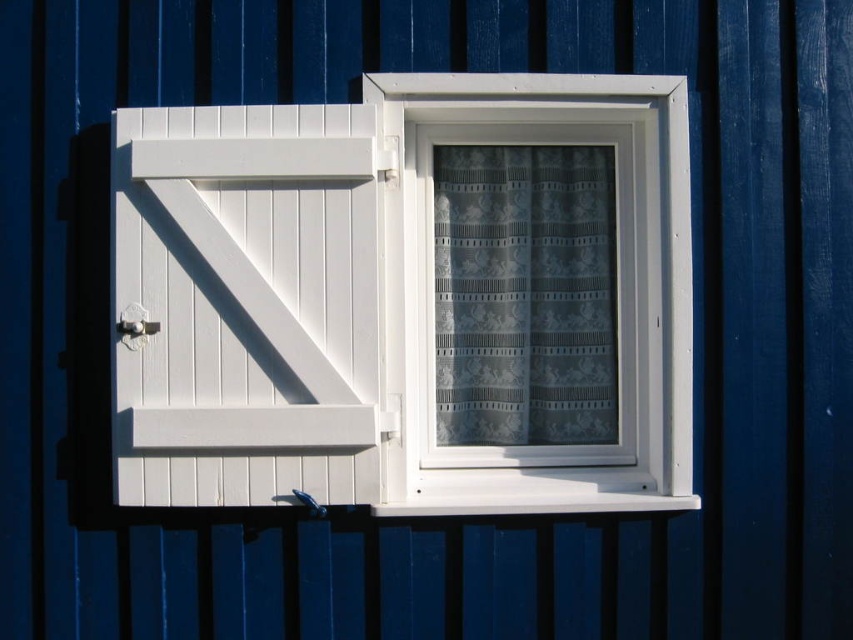
Question: Can you confirm if white wooden barn door at left is wider than translucent lace curtain at center?

Choices:
 (A) yes
 (B) no

Answer: (A)

Question: Which point is farther to the camera?

Choices:
 (A) (492, 156)
 (B) (315, 172)

Answer: (A)

Question: Does white plastic window at center appear over translucent lace curtain at center?

Choices:
 (A) no
 (B) yes

Answer: (B)

Question: Which object is the farthest from the white wooden barn door at left?

Choices:
 (A) white plastic window at center
 (B) translucent lace curtain at center

Answer: (B)

Question: Among these objects, which one is nearest to the camera?

Choices:
 (A) white plastic window at center
 (B) white wooden barn door at left
 (C) translucent lace curtain at center

Answer: (B)

Question: Does white wooden barn door at left have a smaller size compared to translucent lace curtain at center?

Choices:
 (A) yes
 (B) no

Answer: (B)